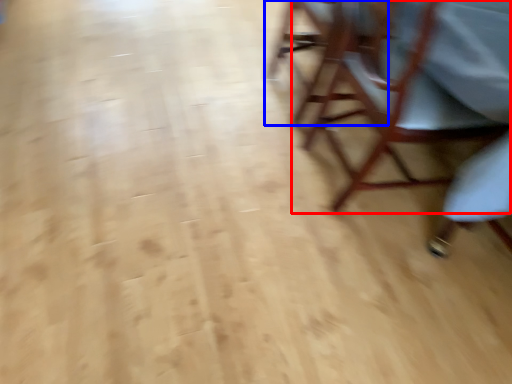
Question: Which point is further to the camera, chair (highlighted by a red box) or chair (highlighted by a blue box)?

Choices:
 (A) chair
 (B) chair

Answer: (B)